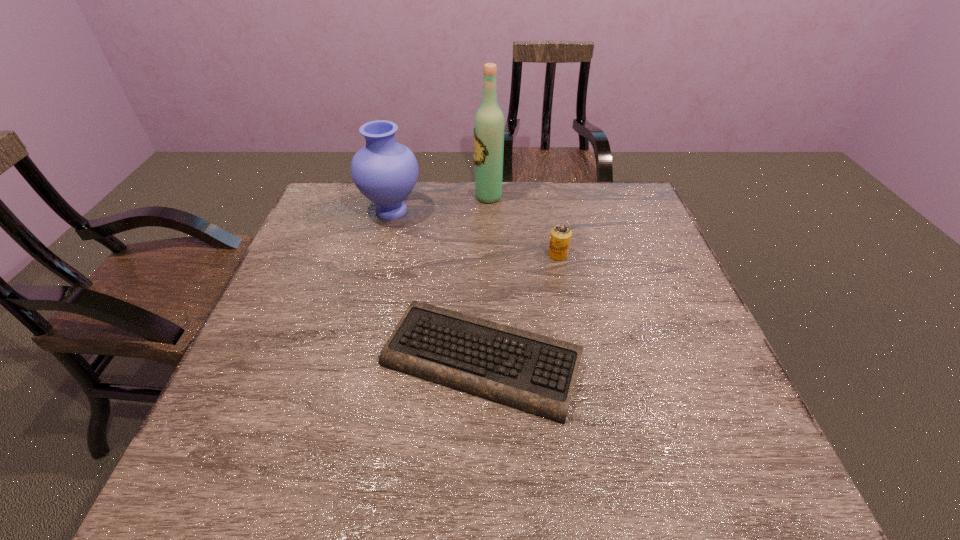
Identify the location of free space that is in between the beer can and the tallest object. (523, 226).

I want to click on the closest object to the third farthest object, so click(x=535, y=373).

Where is `object that can be found as the third closest to the third shortest object`? This screenshot has height=540, width=960. object that can be found as the third closest to the third shortest object is located at coordinates (560, 238).

Identify the location of free point that satisfies the following two spatial constraints: 1. on the front-facing side of the tallest object; 2. on the back side of the beer can. point(490,255).

Where is `free location that satisfies the following two spatial constraints: 1. on the back side of the second shortest object; 2. on the right side of the shortest object`? free location that satisfies the following two spatial constraints: 1. on the back side of the second shortest object; 2. on the right side of the shortest object is located at coordinates (481, 255).

Locate an element on the screen. vacant space that satisfies the following two spatial constraints: 1. on the front-facing side of the tallest object; 2. on the front side of the second tallest object is located at coordinates (489, 211).

Locate an element on the screen. This screenshot has height=540, width=960. free spot that satisfies the following two spatial constraints: 1. on the front-facing side of the wine bottle; 2. on the left side of the beer can is located at coordinates (490, 255).